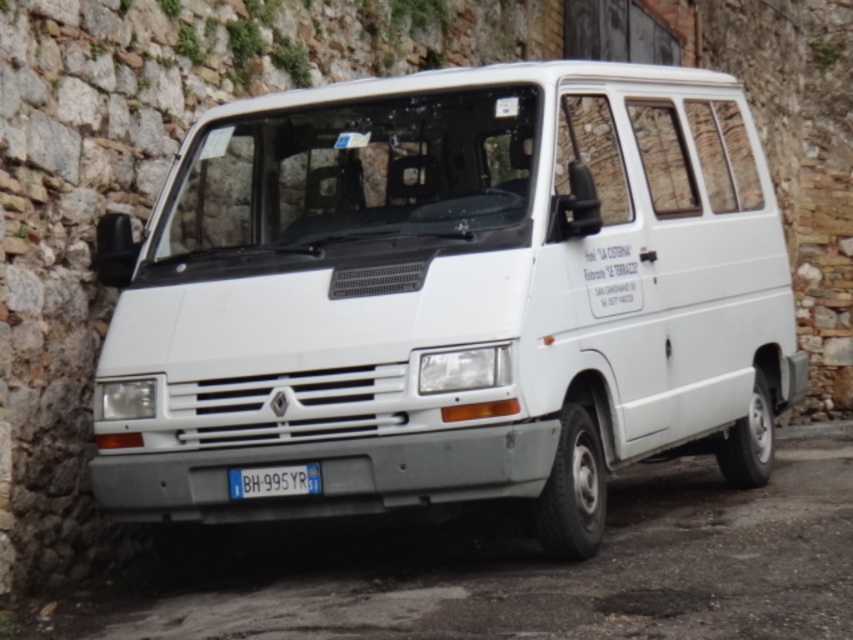
From the picture: Who is shorter, white matte van at center or blue metallic license plate at center?

Standing shorter between the two is blue metallic license plate at center.

Is white matte van at center closer to the viewer compared to blue metallic license plate at center?

Yes, it is.

Who is more distant from viewer, (610, 440) or (310, 483)?

Positioned behind is point (610, 440).

This screenshot has width=853, height=640. I want to click on white matte van at center, so click(x=450, y=298).